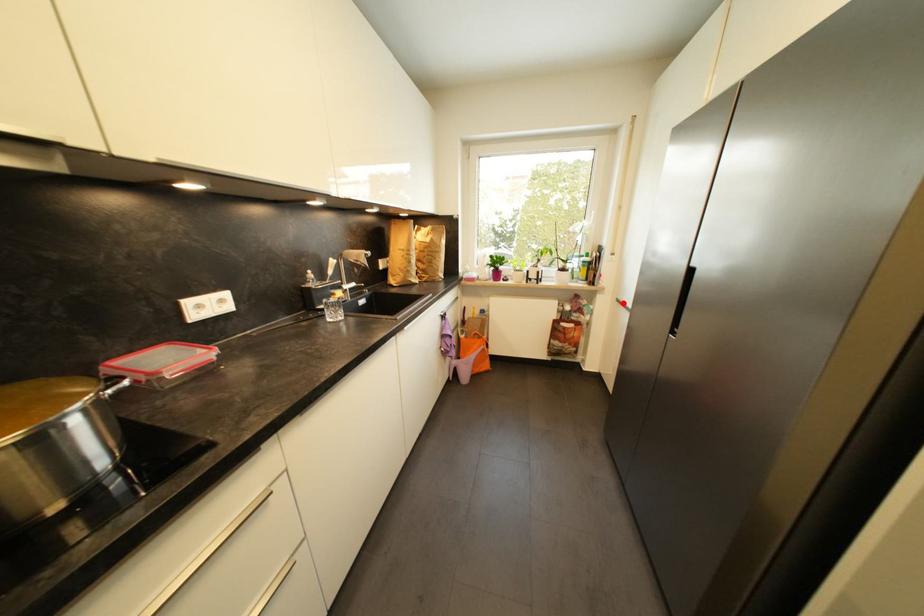
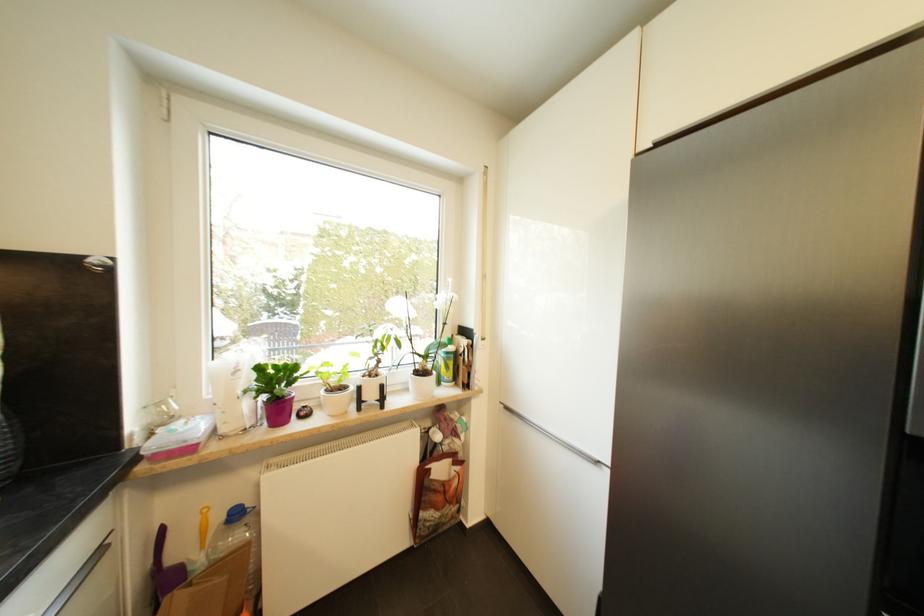
Question: I am providing you with two images of the same scene from different viewpoints. A red point is shown in image1. For the corresponding object point in image2, is it positioned nearer or farther from the camera?

Choices:
 (A) Nearer
 (B) Farther

Answer: (B)